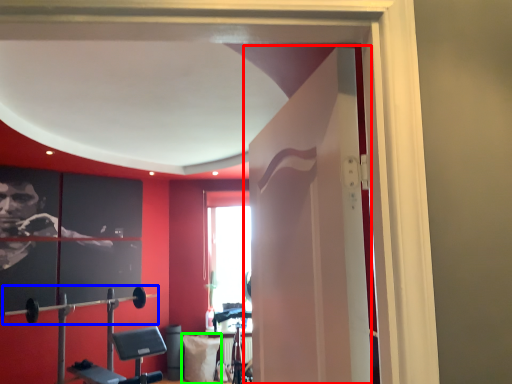
Question: Which object is the closest to the door (highlighted by a red box)? Choose among these: barbell (highlighted by a blue box) or pillow (highlighted by a green box).

Choices:
 (A) barbell
 (B) pillow

Answer: (B)